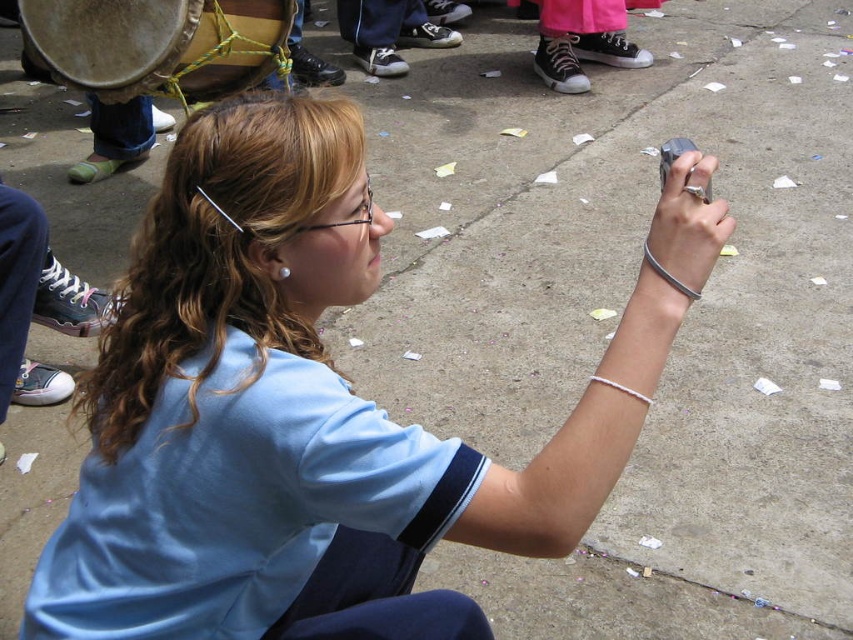
Question: Is wooden drum at left wider than pink canvas shoes at center?

Choices:
 (A) no
 (B) yes

Answer: (B)

Question: Does wooden drum at left appear under pink canvas shoes at center?

Choices:
 (A) no
 (B) yes

Answer: (B)

Question: Is wooden drum at left to the right of pink canvas shoes at center from the viewer's perspective?

Choices:
 (A) no
 (B) yes

Answer: (A)